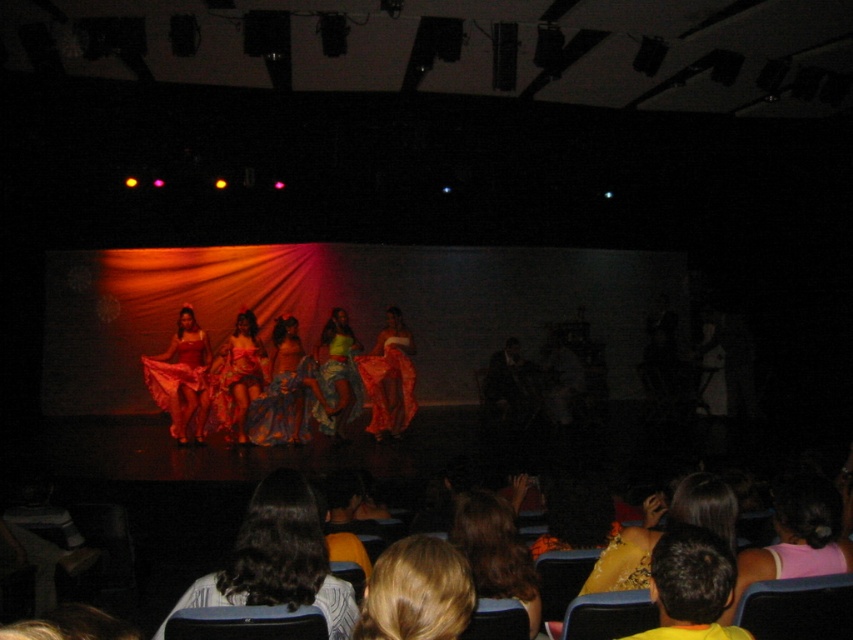
Question: Considering the real-world distances, which object is farthest from the pink fabric dress at lower right?

Choices:
 (A) blonde hair at center
 (B) shiny red dress at center

Answer: (B)

Question: Does pink fabric dress at lower right appear on the left side of shiny red dress at center?

Choices:
 (A) no
 (B) yes

Answer: (A)

Question: Which point appears closest to the camera in this image?

Choices:
 (A) (680, 550)
 (B) (274, 344)

Answer: (A)

Question: Does pink fabric dress at lower right appear over shiny red dress at center?

Choices:
 (A) no
 (B) yes

Answer: (A)

Question: From the image, what is the correct spatial relationship of shiny red dress at center in relation to shiny satin dress at center?

Choices:
 (A) left
 (B) right

Answer: (A)

Question: Which point is farther to the camera?

Choices:
 (A) shiny satin dress at center
 (B) yellow fabric at lower right

Answer: (A)